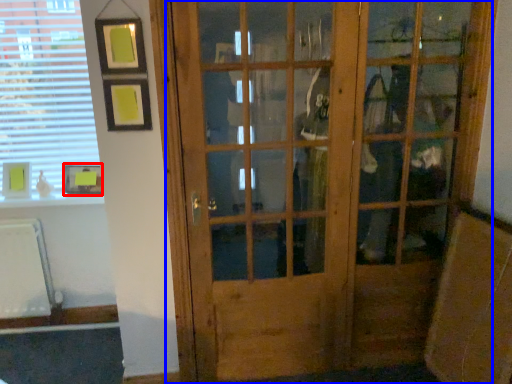
Question: Among these objects, which one is nearest to the camera, picture frame (highlighted by a red box) or door (highlighted by a blue box)?

Choices:
 (A) picture frame
 (B) door

Answer: (B)